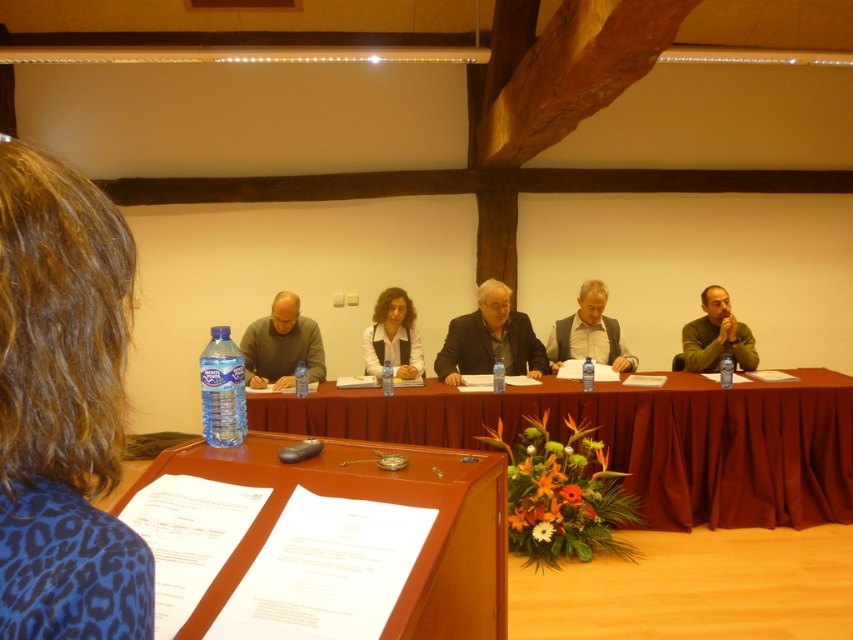
Question: Is the position of dark brown suit at center less distant than that of matte gray shirt at center?

Choices:
 (A) no
 (B) yes

Answer: (A)

Question: Which object is the closest to the matte white shirt at center?

Choices:
 (A) dark brown suit at center
 (B) green matte shirt at right

Answer: (A)

Question: Which point is farther to the camera?

Choices:
 (A) (207, 394)
 (B) (374, 333)

Answer: (B)

Question: Is matte gray shirt at center to the left of green matte shirt at right from the viewer's perspective?

Choices:
 (A) yes
 (B) no

Answer: (A)

Question: Based on their relative distances, which object is nearer to the wooden table at center?

Choices:
 (A) brown curly hair at left
 (B) brown wood table at lower left
 (C) dark brown suit at center
 (D) green matte shirt at right

Answer: (D)

Question: Where is brown curly hair at left located in relation to transparent plastic bottle at left in the image?

Choices:
 (A) right
 (B) left

Answer: (A)